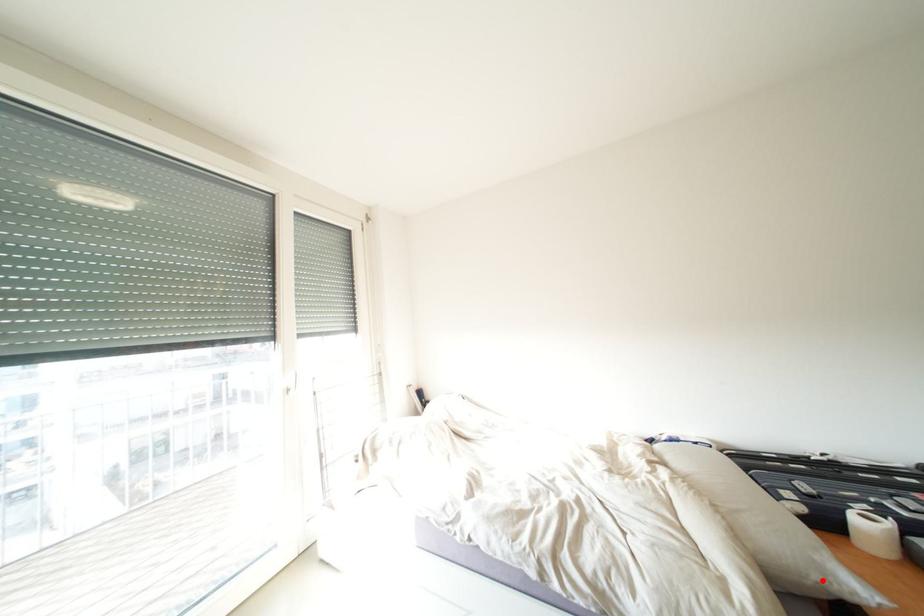
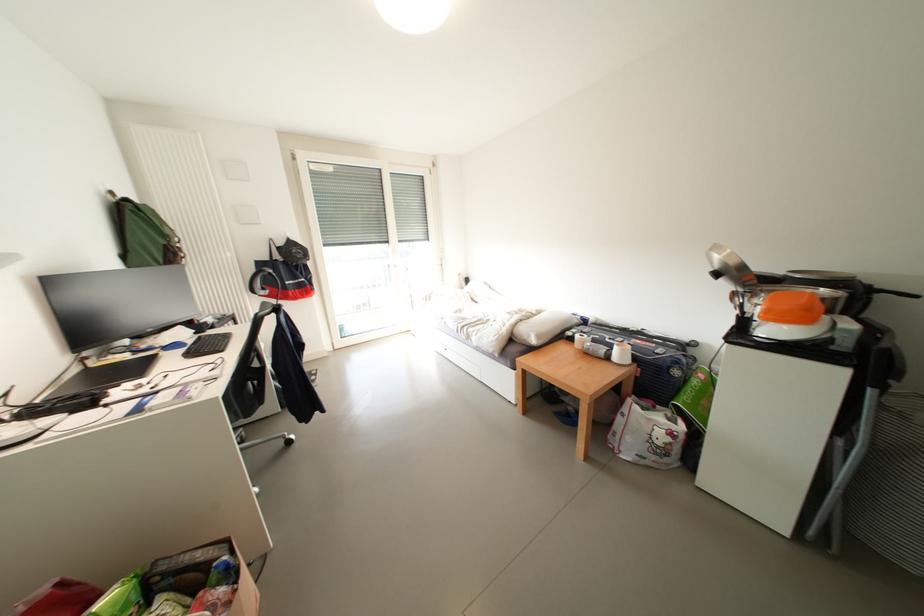
Find the pixel in the second image that matches the highlighted location in the first image.

(532, 341)